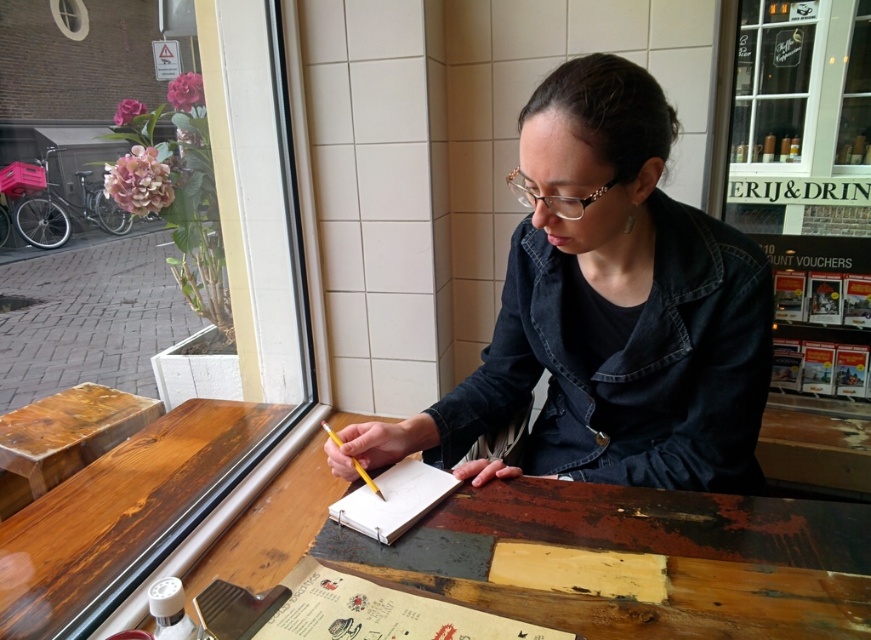
You are standing at the table in the scene. Where is the clear glass window at upper right located in terms of direction and position relative to you?

The clear glass window at upper right is located at the upper right direction from your position at the table, specifically at point coordinates (801, 118).

In the scene shown: You are a customer in the cafe and want to see the outside view through the clear glass window at upper right while still being able to look down at the white paper notebook at center. Is the window positioned in a way that allows you to do both without moving your head?

The clear glass window at upper right is above the white paper notebook at center, so yes, you can look up to see the window and down at the notebook without moving your head.

You are standing in the cafe and want to reach a specific point marked at coordinates point (x=586, y=387). If your arm is 0.9 meters long, can you comfortably reach that point without moving your feet?

The distance of point (x=586, y=387) from viewer is 1.06 meters, so your arm length of 0.9 meters is shorter than the required distance. You cannot comfortably reach the point without moving your feet.